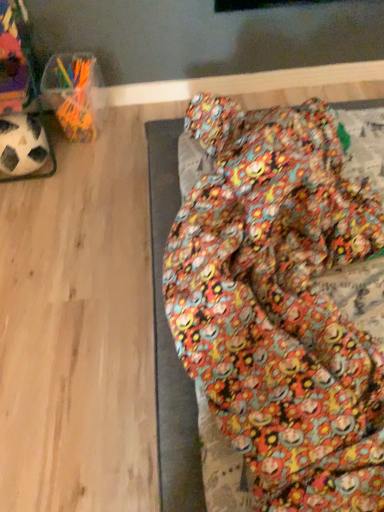
Question: Do you think black matte soccer ball at left is within floral fabric bean bag at lower right, or outside of it?

Choices:
 (A) inside
 (B) outside

Answer: (B)

Question: Looking at their shapes, would you say black matte soccer ball at left is wider or thinner than floral fabric bean bag at lower right?

Choices:
 (A) wide
 (B) thin

Answer: (B)

Question: From the image's perspective, is black matte soccer ball at left above or below floral fabric bean bag at lower right?

Choices:
 (A) above
 (B) below

Answer: (A)

Question: From their relative heights in the image, would you say floral fabric bean bag at lower right is taller or shorter than black matte soccer ball at left?

Choices:
 (A) tall
 (B) short

Answer: (B)

Question: Considering the positions of point (241, 325) and point (13, 142), is point (241, 325) closer or farther from the camera than point (13, 142)?

Choices:
 (A) farther
 (B) closer

Answer: (B)

Question: Considering the relative positions of floral fabric bean bag at lower right and black matte soccer ball at left in the image provided, is floral fabric bean bag at lower right to the left or to the right of black matte soccer ball at left?

Choices:
 (A) left
 (B) right

Answer: (B)

Question: From a real-world perspective, is floral fabric bean bag at lower right positioned above or below black matte soccer ball at left?

Choices:
 (A) below
 (B) above

Answer: (A)